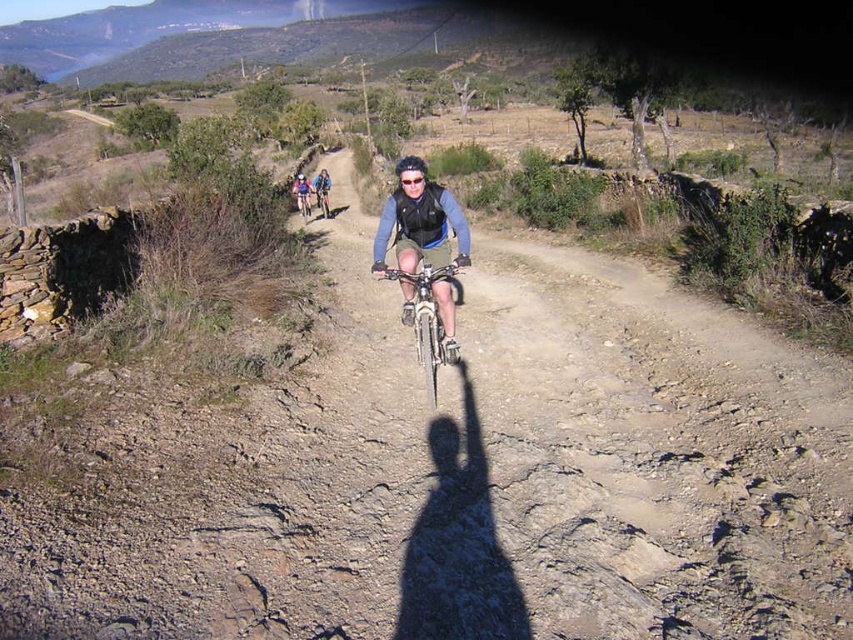
You are a mountain biker approaching the trail. You notice two points on the trail ahead of you. The first point is at coordinates point (431, 291) and the second is at point (415, 186). Which point is closer to you as you ride towards the trail?

Point (431, 291) is closer to you because it is further to the viewer than point (415, 186), meaning it appears nearer in the image.

You are a mountain biker preparing to descend a steep trail. You notice your silver metallic bicycle at center and transparent plastic goggles at center. Which item is positioned lower relative to the ground?

The silver metallic bicycle at center is positioned lower than the transparent plastic goggles at center because it is below the goggles.